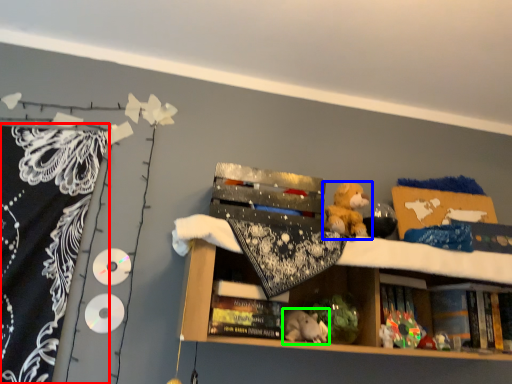
Question: Considering the real-world distances, which object is farthest from blanket (highlighted by a red box)? toy (highlighted by a blue box) or animal (highlighted by a green box)?

Choices:
 (A) toy
 (B) animal

Answer: (A)